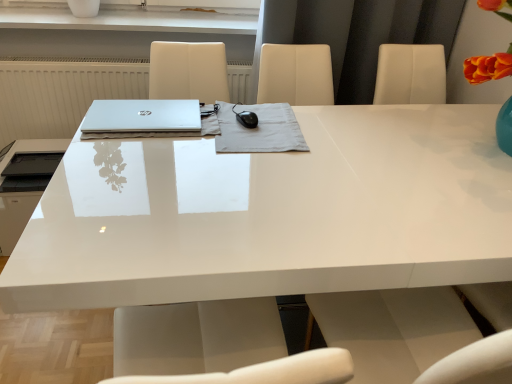
Question: From a real-world perspective, is white glossy desk at center above or below sleek silver laptop at center?

Choices:
 (A) above
 (B) below

Answer: (B)

Question: In the image, is white glossy desk at center positioned in front of or behind sleek silver laptop at center?

Choices:
 (A) behind
 (B) front

Answer: (B)

Question: Which of these objects is positioned farthest from the sleek silver laptop at center?

Choices:
 (A) white glossy desk at center
 (B) matte black printer at left
 (C) white glossy vase at upper center
 (D) satin black mouse at center

Answer: (C)

Question: Based on their relative distances, which object is farther from the matte black printer at left?

Choices:
 (A) white glossy desk at center
 (B) satin black mouse at center
 (C) sleek silver laptop at center
 (D) white glossy vase at upper center

Answer: (B)